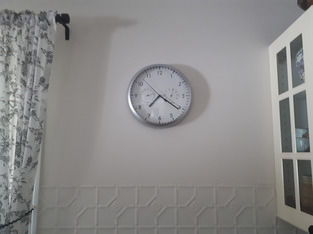
Image resolution: width=313 pixels, height=234 pixels. Find the location of `bowls`. bowls is located at coordinates (307, 184), (305, 197).